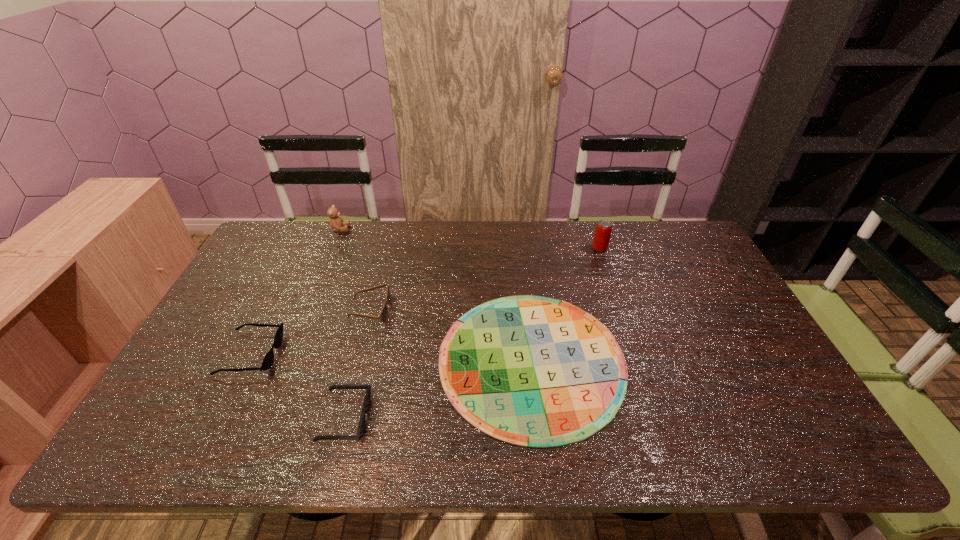
The width and height of the screenshot is (960, 540). I want to click on vacant space that satisfies the following two spatial constraints: 1. on the front-facing side of the leftmost sunglasses; 2. on the back side of the shortest object, so click(x=248, y=360).

The height and width of the screenshot is (540, 960). I want to click on free space that satisfies the following two spatial constraints: 1. on the back side of the second object from right to left; 2. on the front-facing side of the teddy bear, so click(517, 230).

The height and width of the screenshot is (540, 960). Identify the location of vacant area that satisfies the following two spatial constraints: 1. on the back side of the gameboard; 2. on the frames of the farthest sunglasses. (526, 310).

The width and height of the screenshot is (960, 540). What are the coordinates of `free location that satisfies the following two spatial constraints: 1. on the front-facing side of the teddy bear; 2. on the right side of the beer can` in the screenshot? It's located at (332, 248).

The height and width of the screenshot is (540, 960). Identify the location of vacant space that satisfies the following two spatial constraints: 1. on the front-facing side of the second object from right to left; 2. on the right side of the teddy bear. pyautogui.click(x=286, y=360).

This screenshot has height=540, width=960. Find the location of `vacant region that satisfies the following two spatial constraints: 1. on the front-facing side of the shortest object; 2. on the right side of the leftmost sunglasses`. vacant region that satisfies the following two spatial constraints: 1. on the front-facing side of the shortest object; 2. on the right side of the leftmost sunglasses is located at coordinates (248, 360).

Locate an element on the screen. free space that satisfies the following two spatial constraints: 1. on the front-facing side of the second nearest sunglasses; 2. on the right side of the gameboard is located at coordinates (248, 360).